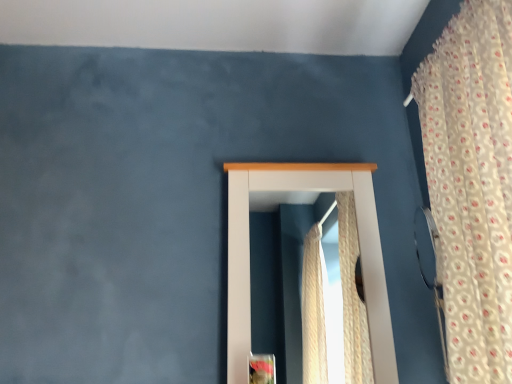
Question: Could you tell me if white wooden window at center is facing floral fabric curtain at right?

Choices:
 (A) no
 (B) yes

Answer: (B)

Question: Can you confirm if white wooden window at center is wider than floral fabric curtain at right?

Choices:
 (A) no
 (B) yes

Answer: (A)

Question: Considering the relative positions of white wooden window at center and floral fabric curtain at right in the image provided, is white wooden window at center to the right of floral fabric curtain at right from the viewer's perspective?

Choices:
 (A) yes
 (B) no

Answer: (B)

Question: From the image's perspective, is white wooden window at center located beneath floral fabric curtain at right?

Choices:
 (A) yes
 (B) no

Answer: (A)

Question: Is white wooden window at center thinner than floral fabric curtain at right?

Choices:
 (A) yes
 (B) no

Answer: (A)

Question: Is white wooden window at center smaller than floral fabric curtain at right?

Choices:
 (A) no
 (B) yes

Answer: (B)

Question: Is floral fabric curtain at right in contact with white wooden window at center?

Choices:
 (A) yes
 (B) no

Answer: (B)

Question: From a real-world perspective, does floral fabric curtain at right stand above white wooden window at center?

Choices:
 (A) no
 (B) yes

Answer: (B)

Question: From the image's perspective, is floral fabric curtain at right beneath white wooden window at center?

Choices:
 (A) yes
 (B) no

Answer: (B)

Question: Is floral fabric curtain at right facing towards white wooden window at center?

Choices:
 (A) yes
 (B) no

Answer: (B)

Question: Is floral fabric curtain at right shorter than white wooden window at center?

Choices:
 (A) no
 (B) yes

Answer: (A)

Question: Is floral fabric curtain at right to the left of white wooden window at center from the viewer's perspective?

Choices:
 (A) yes
 (B) no

Answer: (B)

Question: Does point (252, 206) appear closer or farther from the camera than point (465, 281)?

Choices:
 (A) closer
 (B) farther

Answer: (B)